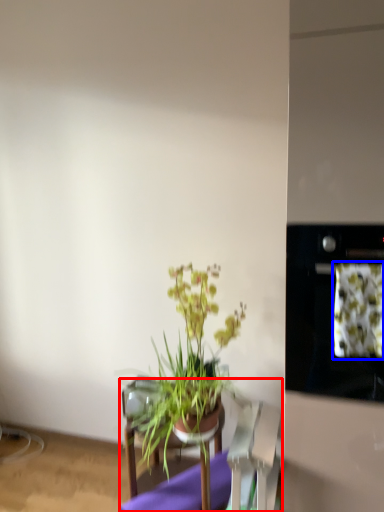
Question: Which object is closer to the camera taking this photo, furniture (highlighted by a red box) or flower (highlighted by a blue box)?

Choices:
 (A) furniture
 (B) flower

Answer: (B)